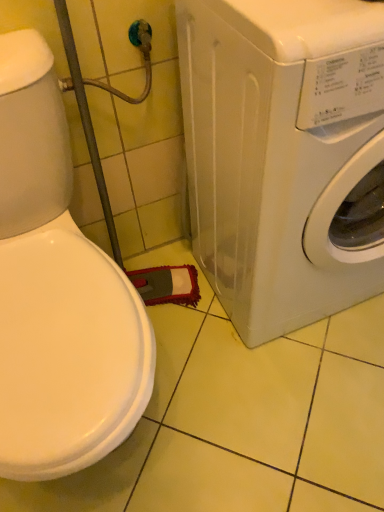
The width and height of the screenshot is (384, 512). In order to click on white glossy washing machine at lower right in this screenshot , I will do `click(284, 155)`.

What do you see at coordinates (284, 155) in the screenshot? I see `white glossy washing machine at lower right` at bounding box center [284, 155].

This screenshot has height=512, width=384. Find the location of `white glossy washing machine at lower right`. white glossy washing machine at lower right is located at coordinates (284, 155).